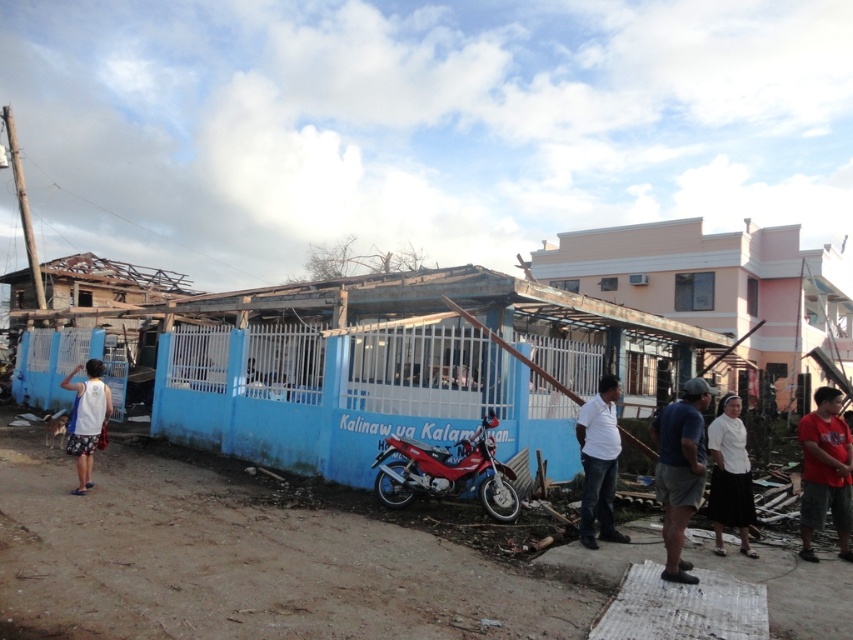
Question: Among these objects, which one is farthest from the camera?

Choices:
 (A) white fabric bag at left
 (B) white cotton shirt at center
 (C) brown fabric shorts at lower right

Answer: (A)

Question: Which point is farther from the camera taking this photo?

Choices:
 (A) (604, 403)
 (B) (698, 445)
 (C) (80, 387)

Answer: (C)

Question: Which object is closer to the camera taking this photo?

Choices:
 (A) red cotton shirt at lower right
 (B) brown fabric shorts at lower right
 (C) red matte motorcycle at center
 (D) white cotton blouse at center

Answer: (B)

Question: Does brown fabric shorts at lower right come in front of red cotton shirt at lower right?

Choices:
 (A) no
 (B) yes

Answer: (B)

Question: Is red matte motorcycle at center thinner than white cotton shirt at center?

Choices:
 (A) yes
 (B) no

Answer: (B)

Question: Is red matte motorcycle at center wider than white fabric bag at left?

Choices:
 (A) no
 (B) yes

Answer: (B)